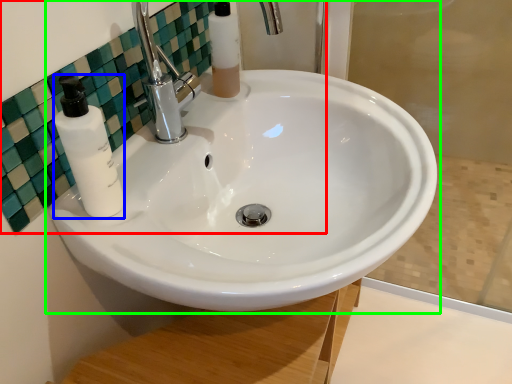
Question: Considering the real-world distances, which object is farthest from mirror (highlighted by a red box)? soap dispenser (highlighted by a blue box) or sink (highlighted by a green box)?

Choices:
 (A) soap dispenser
 (B) sink

Answer: (B)